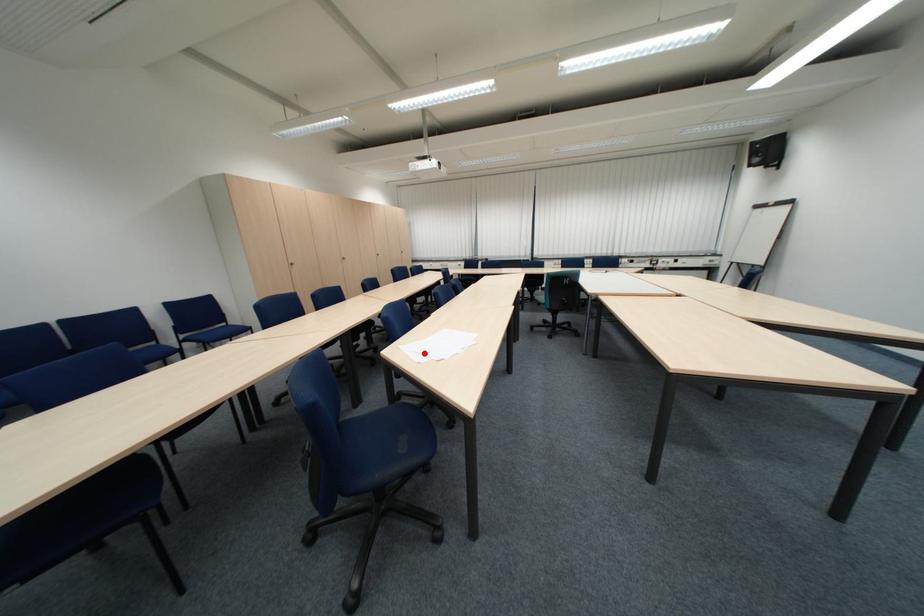
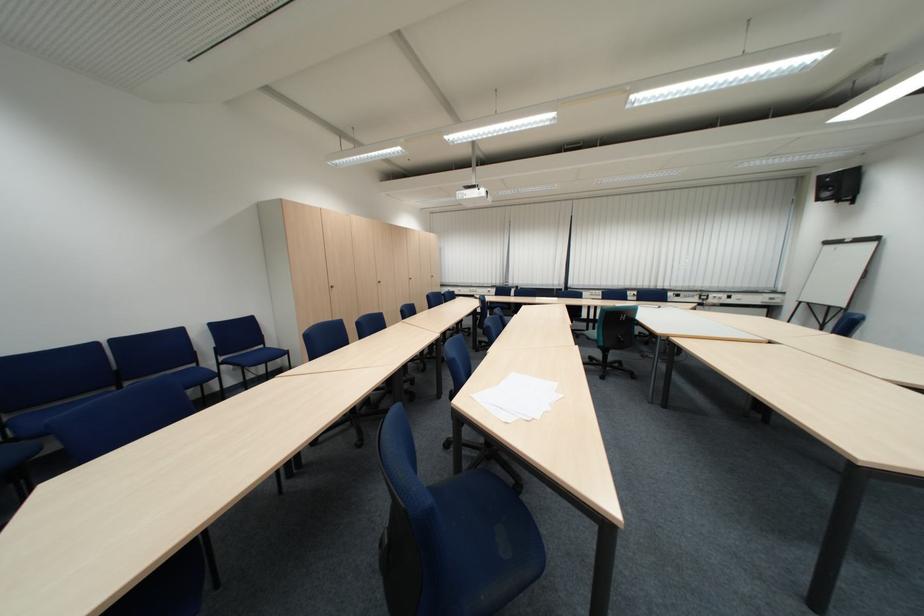
In the second image, find the point that corresponds to the highlighted location in the first image.

(505, 407)